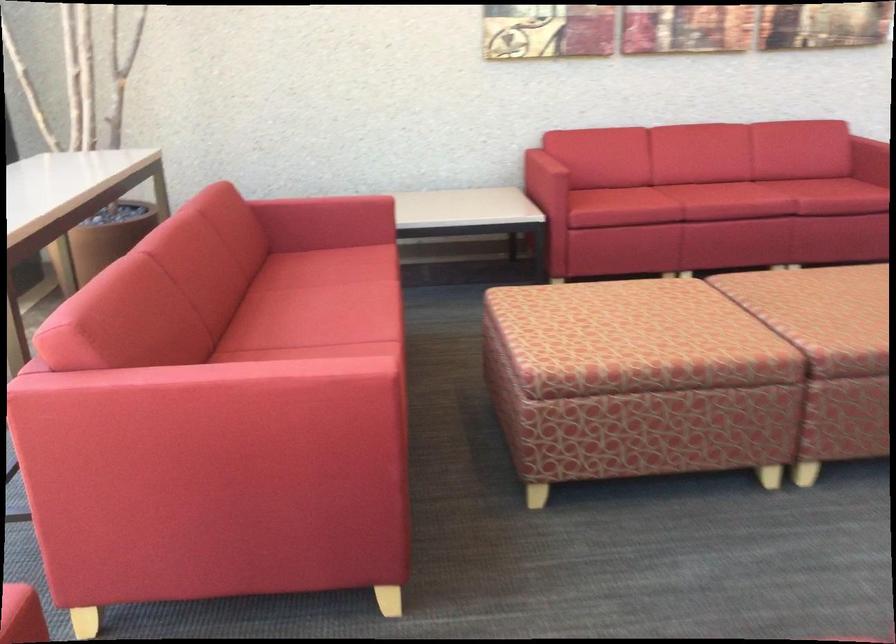
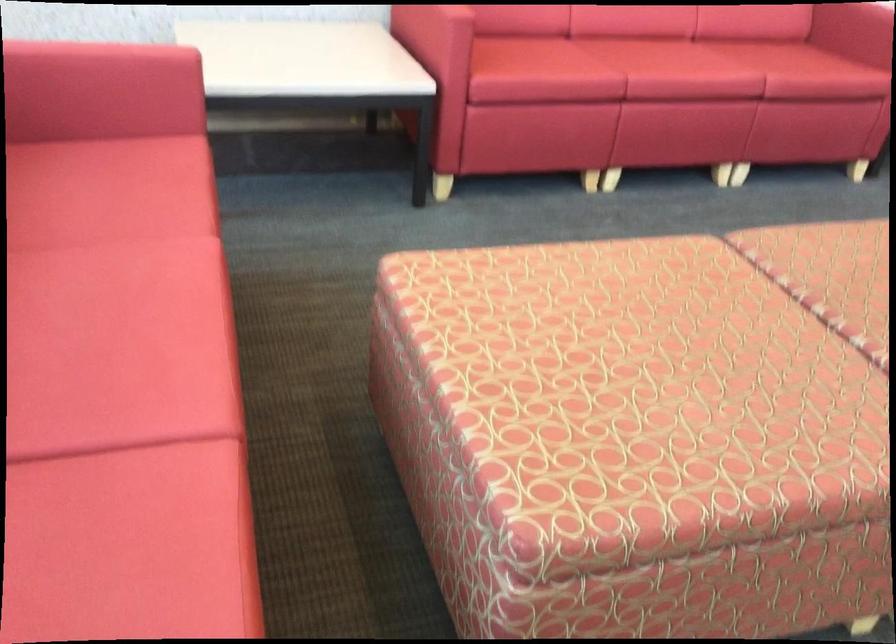
Find the pixel in the second image that matches point 352,323 in the first image.

(117, 381)